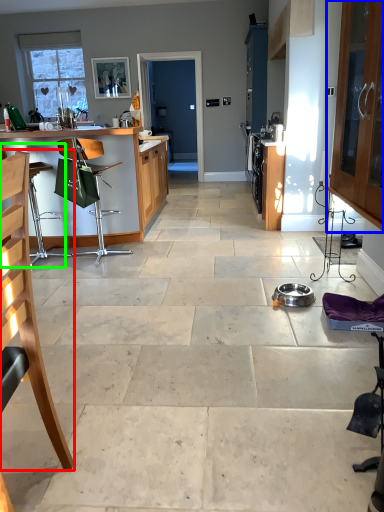
Question: Based on their relative distances, which object is farther from chair (highlighted by a red box)? Choose from cabinetry (highlighted by a blue box) and armchair (highlighted by a green box).

Choices:
 (A) cabinetry
 (B) armchair

Answer: (B)